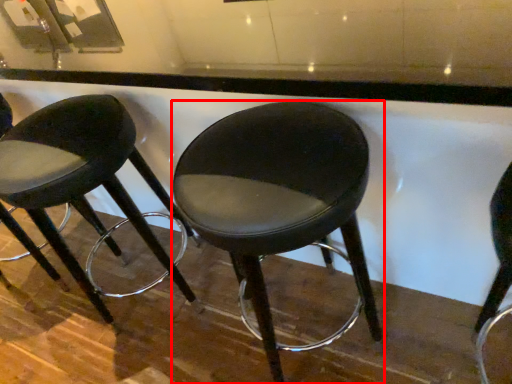
Question: From the image's perspective, considering the relative positions of stool (annotated by the red box) and stool in the image provided, where is stool (annotated by the red box) located with respect to the staircase?

Choices:
 (A) above
 (B) below

Answer: (B)